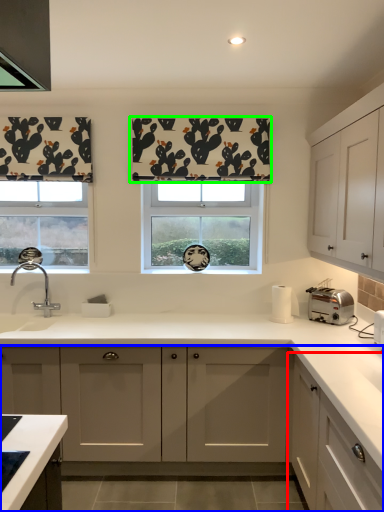
Question: Based on their relative distances, which object is nearer to cabinetry (highlighted by a red box)? Choose from cabinetry (highlighted by a blue box) and curtain (highlighted by a green box).

Choices:
 (A) cabinetry
 (B) curtain

Answer: (A)